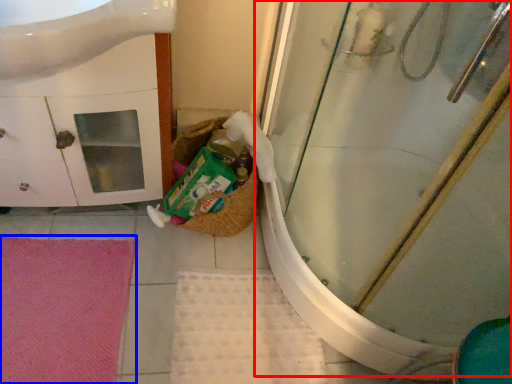
Question: Which of the following is the farthest to the observer, shower door (highlighted by a red box) or bath mat (highlighted by a blue box)?

Choices:
 (A) shower door
 (B) bath mat

Answer: (B)